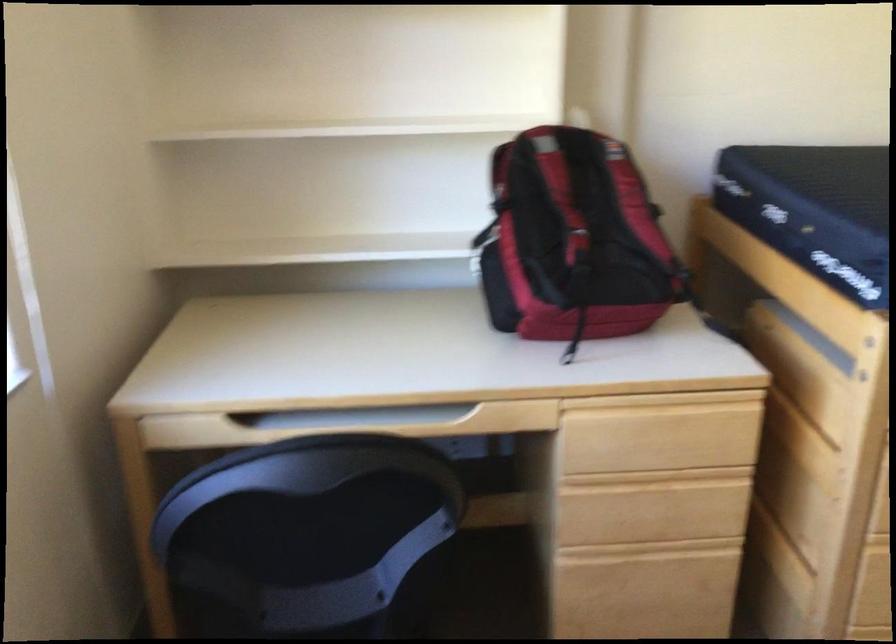
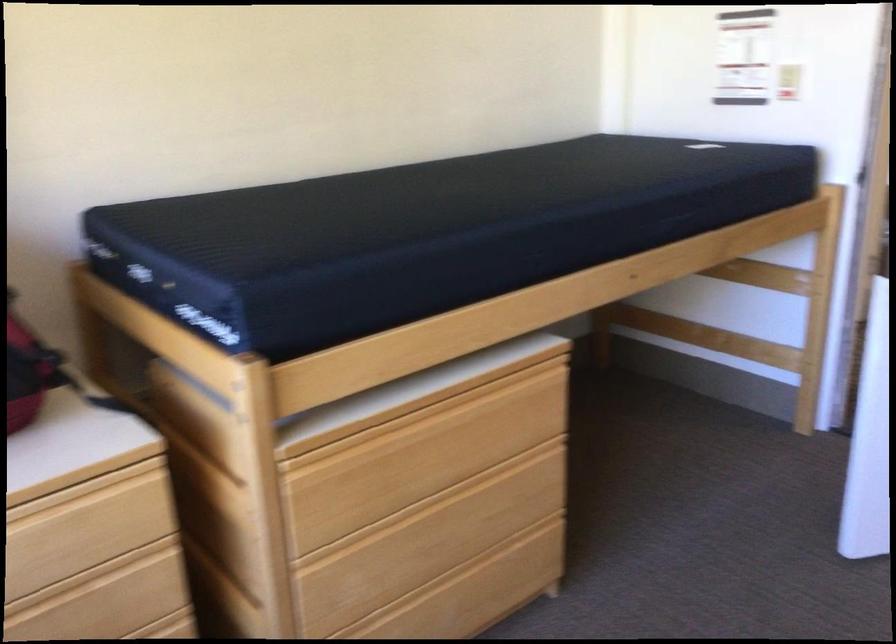
Question: The camera is either moving clockwise (left) or counter-clockwise (right) around the object. The first image is from the beginning of the video and the second image is from the end. Is the camera moving left or right when shooting the video?

Choices:
 (A) Left
 (B) Right

Answer: (A)